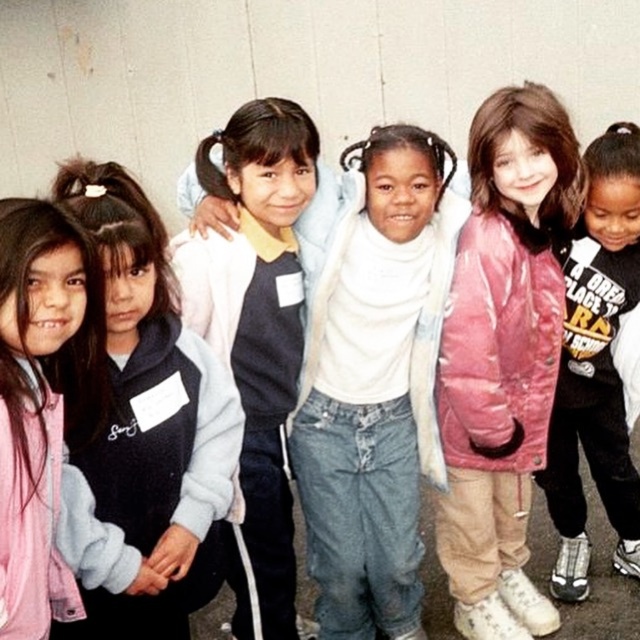
You are a photographer trying to capture a photo of the two pink jackets in the image. The pink shiny jacket at center and the pink fleece jacket at center. Which one is positioned to the left?

The pink shiny jacket at center is to the left of the pink fleece jacket at center.

You are a photographer standing in front of the group of children. You want to take a photo of the pink shiny jacket at center. Where should you aim your camera to capture it?

You should aim your camera at point 0.558 on the x axis and 0.787 on the y axis to capture the pink shiny jacket at center.

You are a photographer trying to capture a photo of both the white matte jacket at center and the pink fleece jacket at left. Since you want to ensure both are in focus, which jacket should you focus on first to account for their positions?

You should focus on the white matte jacket at center first because it is closer to you than the pink fleece jacket at left, so adjusting focus from near to far will help both jackets be in focus.